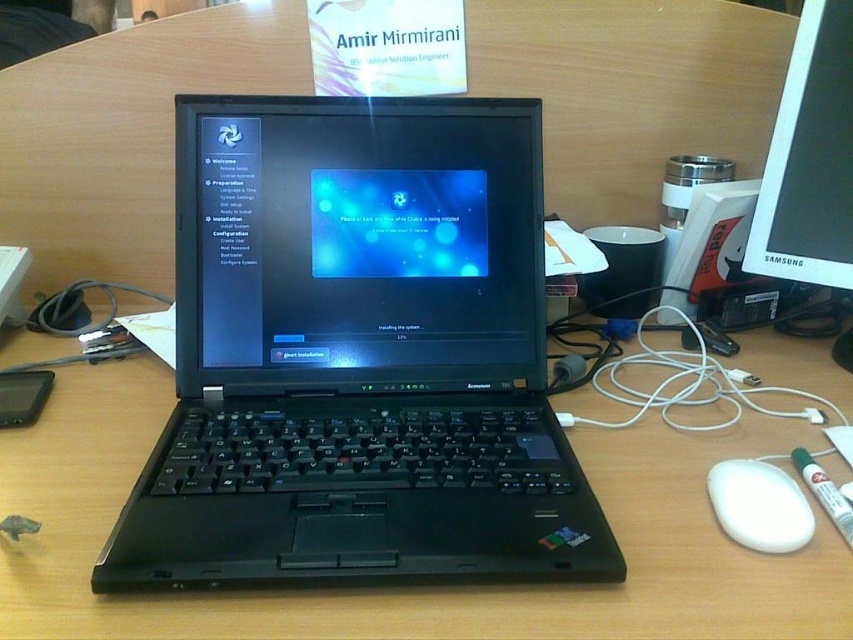
Can you confirm if black matte laptop at center is thinner than black glossy laptop at center?

Incorrect, black matte laptop at center's width is not less than black glossy laptop at center's.

How far apart are black matte laptop at center and black glossy laptop at center?

black matte laptop at center is 1.36 inches away from black glossy laptop at center.

The height and width of the screenshot is (640, 853). Identify the location of black matte laptop at center. (358, 355).

Is black matte laptop at center wider than white matte mouse at lower right?

Correct, the width of black matte laptop at center exceeds that of white matte mouse at lower right.

Is black matte laptop at center positioned before white matte mouse at lower right?

Yes, black matte laptop at center is closer to the viewer.

Is point (503, 211) positioned before point (784, 474)?

No, (503, 211) is further to viewer.

At what (x,y) coordinates should I click in order to perform the action: click on black matte laptop at center. Please return your answer as a coordinate pair (x, y). The height and width of the screenshot is (640, 853). Looking at the image, I should click on (358, 355).

Is point (784, 189) positioned before point (724, 460)?

No, it is behind (724, 460).

Between point (822, 24) and point (776, 509), which one is positioned in front?

Positioned in front is point (776, 509).

This screenshot has height=640, width=853. I want to click on white glossy monitor at center, so click(809, 157).